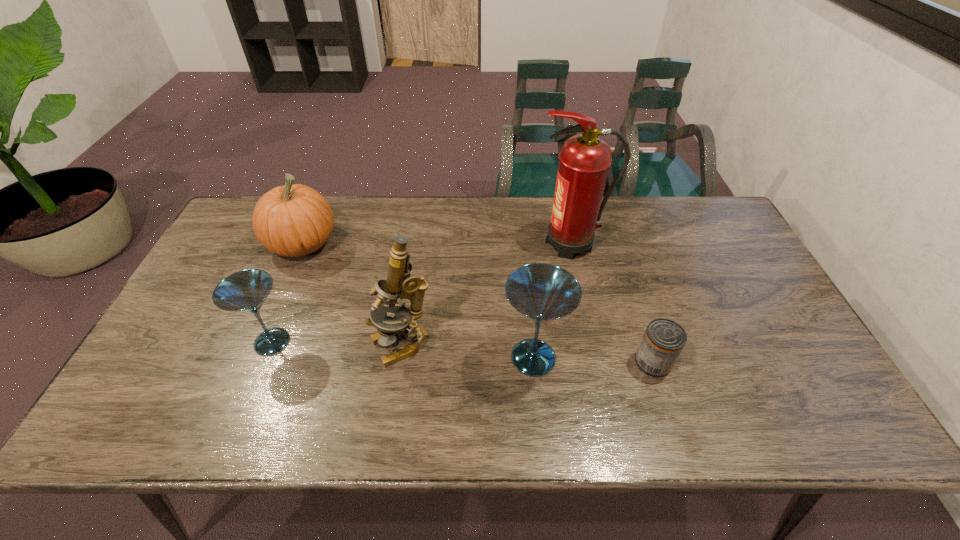
The image size is (960, 540). Find the location of `vacant place for an extra martini on the right`. vacant place for an extra martini on the right is located at coordinates (810, 375).